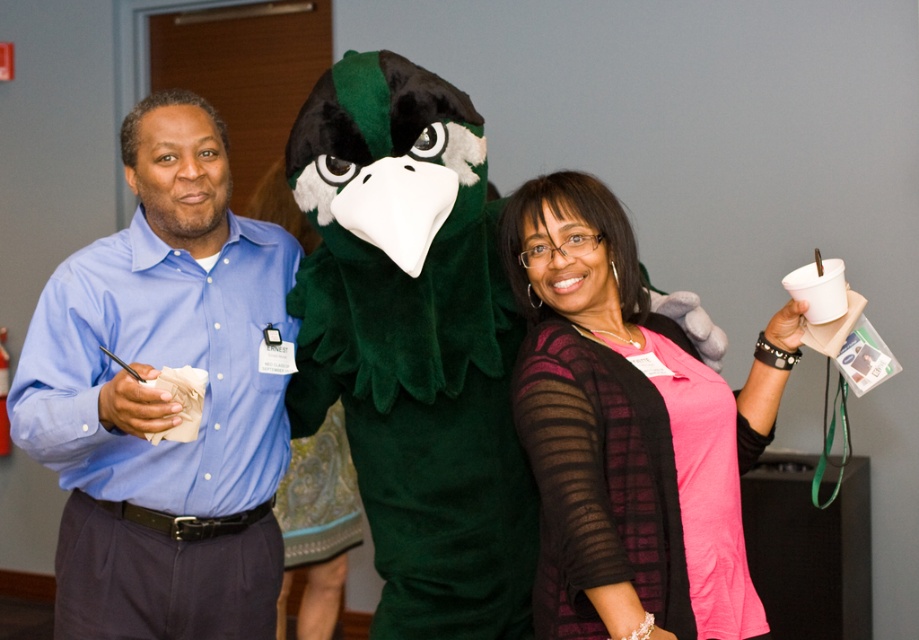
Question: From the image, what is the correct spatial relationship of blue shirt at left in relation to green fuzzy mascot at center?

Choices:
 (A) below
 (B) above

Answer: (A)

Question: Based on their relative distances, which object is farther from the green fuzzy mascot at center?

Choices:
 (A) pink matte shirt at center
 (B) blue shirt at left

Answer: (B)

Question: Does green fuzzy mascot at center appear on the right side of pink matte shirt at center?

Choices:
 (A) no
 (B) yes

Answer: (A)

Question: Considering the real-world distances, which object is closest to the blue shirt at left?

Choices:
 (A) pink matte shirt at center
 (B) green fuzzy mascot at center

Answer: (B)

Question: Does green fuzzy mascot at center appear over pink matte shirt at center?

Choices:
 (A) yes
 (B) no

Answer: (A)

Question: Which point is closer to the camera?

Choices:
 (A) (739, 408)
 (B) (82, 438)

Answer: (B)